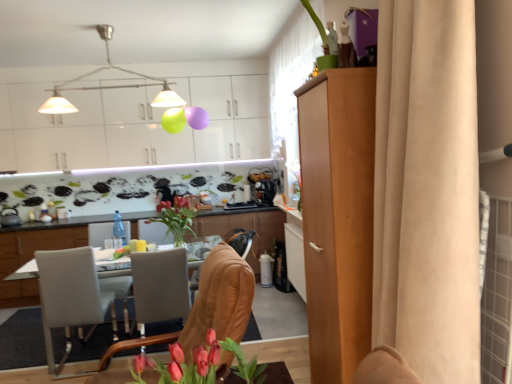
Find the location of `free space above metallic pendant lights at upper center (from a real-world perspective)`. free space above metallic pendant lights at upper center (from a real-world perspective) is located at coordinates (106, 23).